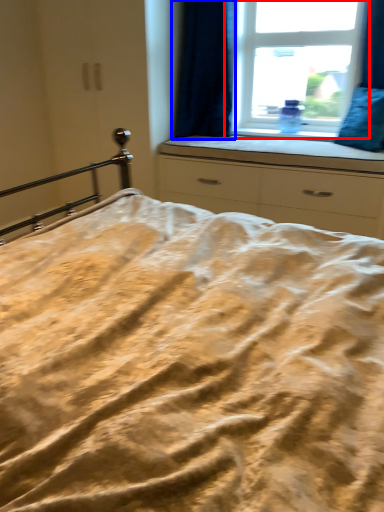
Question: Among these objects, which one is farthest to the camera, window (highlighted by a red box) or curtain (highlighted by a blue box)?

Choices:
 (A) window
 (B) curtain

Answer: (A)